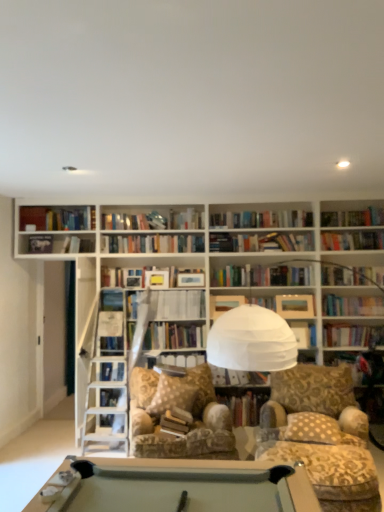
Where is `hardcover book at center, which is the 2th paperback book from bottom to top`? This screenshot has height=512, width=384. hardcover book at center, which is the 2th paperback book from bottom to top is located at coordinates (111, 300).

What do you see at coordinates (186, 219) in the screenshot? The image size is (384, 512). I see `hardcover book at center, which appears as the 1th book when viewed from the top` at bounding box center [186, 219].

What is the approximate height of beige dotted pillow at center?

24.06 centimeters.

The image size is (384, 512). Describe the element at coordinates (177, 304) in the screenshot. I see `white paper at center, marked as the 2th book in a bottom-to-top arrangement` at that location.

The width and height of the screenshot is (384, 512). In order to click on patterned fabric swivel chair at center in this screenshot , I will do `click(178, 415)`.

Locate an element on the screen. The width and height of the screenshot is (384, 512). hardcover book at center, which is counted as the 4th paperback book, starting from the right is located at coordinates (111, 300).

Is hardcover book at center, which is the first paperback book in right-to-left order, inside or outside of patterned fabric swivel chair at center?

hardcover book at center, which is the first paperback book in right-to-left order, is not enclosed by patterned fabric swivel chair at center.

Between point (240, 297) and point (221, 420), which one is positioned behind?

The point (240, 297) is farther.

The width and height of the screenshot is (384, 512). Identify the location of the 1st paperback book above the patterned fabric swivel chair at center (from the image's perspective). (224, 304).

Based on the photo, does patterned fabric chair at center lie behind hardcover book at center, which is the first paperback book in right-to-left order?

No, patterned fabric chair at center is closer to the viewer.

Would you say patterned fabric chair at center is a long distance from hardcover book at center, which is the first paperback book in right-to-left order?

Yes.

This screenshot has height=512, width=384. Find the location of `chair below the hardcover book at center, which is the first paperback book in right-to-left order (from the image's perspective)`. chair below the hardcover book at center, which is the first paperback book in right-to-left order (from the image's perspective) is located at coordinates (321, 435).

From the image's perspective, between patterned fabric chair at center and hardcover book at center, the 1th paperback book ordered from the bottom, which one is located above?

hardcover book at center, the 1th paperback book ordered from the bottom, is shown above in the image.

In the scene shown: Is hardcover book at center, arranged as the 3th paperback book when viewed from the top, wider or thinner than yellow matte paper at center, the third paperback book when ordered from right to left?

Considering their sizes, hardcover book at center, arranged as the 3th paperback book when viewed from the top, looks broader than yellow matte paper at center, the third paperback book when ordered from right to left.

Considering the relative positions of hardcover book at center, which is the fourth paperback book in left-to-right order, and yellow matte paper at center, which appears as the 3th paperback book when viewed from the left, in the image provided, is hardcover book at center, which is the fourth paperback book in left-to-right order, to the left or to the right of yellow matte paper at center, which appears as the 3th paperback book when viewed from the left,?

From the image, it's evident that hardcover book at center, which is the fourth paperback book in left-to-right order, is to the right of yellow matte paper at center, which appears as the 3th paperback book when viewed from the left.

Is yellow matte paper at center, which is the second paperback book in top-to-bottom order, a part of hardcover book at center, which is the fourth paperback book in left-to-right order?

Definitely not — yellow matte paper at center, which is the second paperback book in top-to-bottom order, is not inside hardcover book at center, which is the fourth paperback book in left-to-right order.

Does point (182, 275) appear closer or farther from the camera than point (151, 273)?

Point (182, 275) is positioned farther from the camera compared to point (151, 273).

Is hardcover book at center, arranged as the third paperback book when ordered from the bottom, inside or outside of hardcover book at upper left, marked as the first paperback book in a top-to-bottom arrangement?

hardcover book at center, arranged as the third paperback book when ordered from the bottom, is not enclosed by hardcover book at upper left, marked as the first paperback book in a top-to-bottom arrangement.

Between hardcover book at center, arranged as the 3th paperback book when viewed from the top, and hardcover book at upper left, marked as the first paperback book in a top-to-bottom arrangement, which one has smaller width?

With smaller width is hardcover book at center, arranged as the 3th paperback book when viewed from the top.

Is point (189, 274) farther from camera compared to point (41, 237)?

Yes.

Considering the sizes of objects hardcover book at center, acting as the 2th paperback book starting from the left, and hardcover book at center, marked as the 3th book in a bottom-to-top arrangement, in the image provided, who is thinner, hardcover book at center, acting as the 2th paperback book starting from the left, or hardcover book at center, marked as the 3th book in a bottom-to-top arrangement,?

hardcover book at center, acting as the 2th paperback book starting from the left, is thinner.

Between hardcover book at center, which is counted as the 4th paperback book, starting from the right, and hardcover book at center, which appears as the 1th book when viewed from the top, which one is positioned behind?

hardcover book at center, which appears as the 1th book when viewed from the top, is more distant.

Considering the points (118, 309) and (203, 215), which point is behind, point (118, 309) or point (203, 215)?

Positioned behind is point (203, 215).

Can you confirm if hardcover book at center, which is the 2th paperback book from bottom to top, is shorter than hardcover book at center, placed as the second book when sorted from left to right?

Incorrect, the height of hardcover book at center, which is the 2th paperback book from bottom to top, does not fall short of that of hardcover book at center, placed as the second book when sorted from left to right.

Consider the image. Is patterned fabric chair at center thinner than beige dotted pillow at center?

No, patterned fabric chair at center is not thinner than beige dotted pillow at center.

How many degrees apart are the facing directions of patterned fabric chair at center and beige dotted pillow at center?

patterned fabric chair at center and beige dotted pillow at center are facing 0.0881 degrees away from each other.

From a real-world perspective, which is physically below, patterned fabric chair at center or beige dotted pillow at center?

From a 3D spatial view, patterned fabric chair at center is below.

Considering the positions of objects patterned fabric chair at center and beige dotted pillow at center in the image provided, who is more to the right, patterned fabric chair at center or beige dotted pillow at center?

beige dotted pillow at center is more to the right.

Is point (161, 276) behind point (198, 224)?

No, (161, 276) is in front of (198, 224).

From the image's perspective, which object appears higher, yellow matte paper at center, which is the second paperback book in top-to-bottom order, or hardcover book at center, placed as the second book when sorted from left to right?

hardcover book at center, placed as the second book when sorted from left to right, from the image's perspective.

Can you see yellow matte paper at center, which appears as the 3th paperback book when viewed from the left, touching hardcover book at center, marked as the 3th book in a bottom-to-top arrangement?

No, yellow matte paper at center, which appears as the 3th paperback book when viewed from the left, is not next to hardcover book at center, marked as the 3th book in a bottom-to-top arrangement.

Considering the sizes of objects yellow matte paper at center, which is the 4th paperback book in bottom-to-top order, and hardcover book at center, placed as the second book when sorted from left to right, in the image provided, who is shorter, yellow matte paper at center, which is the 4th paperback book in bottom-to-top order, or hardcover book at center, placed as the second book when sorted from left to right,?

With less height is yellow matte paper at center, which is the 4th paperback book in bottom-to-top order.

Locate an element on the screen. paperback book that is the 1st one when counting upward from the patterned fabric swivel chair at center (from the image's perspective) is located at coordinates (224, 304).

Find the location of a particular element. The height and width of the screenshot is (512, 384). the 1st paperback book located above the patterned fabric chair at center (from a real-world perspective) is located at coordinates (224, 304).

Estimate the real-world distances between objects in this image. Which object is further from patterned fabric swivel chair at center, white paper at center, marked as the 2th book in a bottom-to-top arrangement, or hardcover book at center, the fifth paperback book in the top-to-bottom sequence?

hardcover book at center, the fifth paperback book in the top-to-bottom sequence, is further to patterned fabric swivel chair at center.

From the image, which object appears to be farther from patterned fabric swivel chair at center, beige dotted pillow at center or hardcover book at center, which appears as the 1th book when viewed from the top?

The object further to patterned fabric swivel chair at center is hardcover book at center, which appears as the 1th book when viewed from the top.

When comparing their distances from hardcover book at upper left, positioned as the fifth paperback book in right-to-left order, does hardcover book at center, the 1th paperback book ordered from the bottom, or white paper at center, acting as the second book starting from the top, seem further?

Based on the image, hardcover book at center, the 1th paperback book ordered from the bottom, appears to be further to hardcover book at upper left, positioned as the fifth paperback book in right-to-left order.

Based on their spatial positions, is hardcover book at center, arranged as the 3th paperback book when viewed from the top, or hardcover book at center, which is the first paperback book in right-to-left order, further from hardcover book at center, which is counted as the first book, starting from the right?

hardcover book at center, arranged as the 3th paperback book when viewed from the top, is positioned further to the anchor hardcover book at center, which is counted as the first book, starting from the right.

Estimate the real-world distances between objects in this image. Which object is closer to patterned fabric swivel chair at center, white paper at center, marked as the 2th book in a bottom-to-top arrangement, or hardcover book at center, arranged as the third paperback book when ordered from the bottom?

white paper at center, marked as the 2th book in a bottom-to-top arrangement, lies closer to patterned fabric swivel chair at center than the other object.

When comparing their distances from hardcover book at center, placed as the second book when sorted from left to right, does yellow matte paper at center, which is the 4th paperback book in bottom-to-top order, or hardcover book at upper left, marked as the first paperback book in a top-to-bottom arrangement, seem closer?

yellow matte paper at center, which is the 4th paperback book in bottom-to-top order, lies closer to hardcover book at center, placed as the second book when sorted from left to right, than the other object.

Which object lies further to the anchor point hardcover book at center, which is counted as the 4th paperback book, starting from the right, white paper at center, which appears as the third book when viewed from the right, or yellow matte paper at center, which is the second paperback book in top-to-bottom order?

Among the two, white paper at center, which appears as the third book when viewed from the right, is located further to hardcover book at center, which is counted as the 4th paperback book, starting from the right.

Consider the image. Estimate the real-world distances between objects in this image. Which object is further from hardcover book at upper left, positioned as the fifth paperback book in right-to-left order, hardcover book at center, which is the 2th paperback book from right to left, or white paper at center, marked as the 2th book in a bottom-to-top arrangement?

hardcover book at center, which is the 2th paperback book from right to left, lies further to hardcover book at upper left, positioned as the fifth paperback book in right-to-left order, than the other object.

This screenshot has width=384, height=512. What are the coordinates of `pillow positioned between patterned fabric chair at center and hardcover book at center, the third book from the top, from near to far` in the screenshot? It's located at (312, 428).

Locate an element on the screen. The height and width of the screenshot is (512, 384). swivel chair between beige dotted pillow at center and white paper at center, which appears as the third book when viewed from the right, from front to back is located at coordinates (178, 415).

This screenshot has width=384, height=512. Find the location of `book between hardcover book at center, marked as the 2th book in a right-to-left arrangement, and patterned fabric swivel chair at center, in the vertical direction`. book between hardcover book at center, marked as the 2th book in a right-to-left arrangement, and patterned fabric swivel chair at center, in the vertical direction is located at coordinates (177, 304).

Where is `paperback book between white paper at center, the first book when ordered from left to right, and hardcover book at center, which is counted as the first book, starting from the right, from top to bottom`? This screenshot has width=384, height=512. paperback book between white paper at center, the first book when ordered from left to right, and hardcover book at center, which is counted as the first book, starting from the right, from top to bottom is located at coordinates (224, 304).